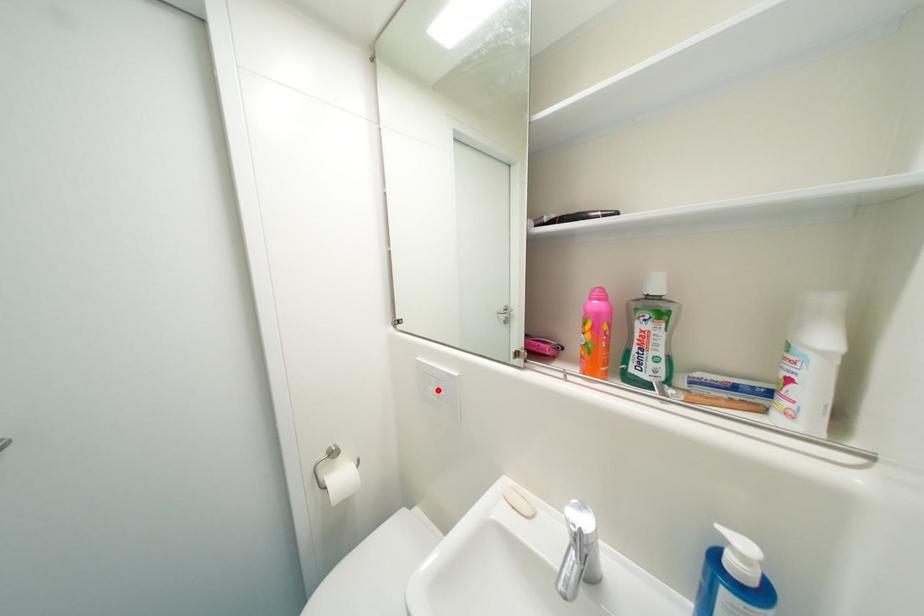
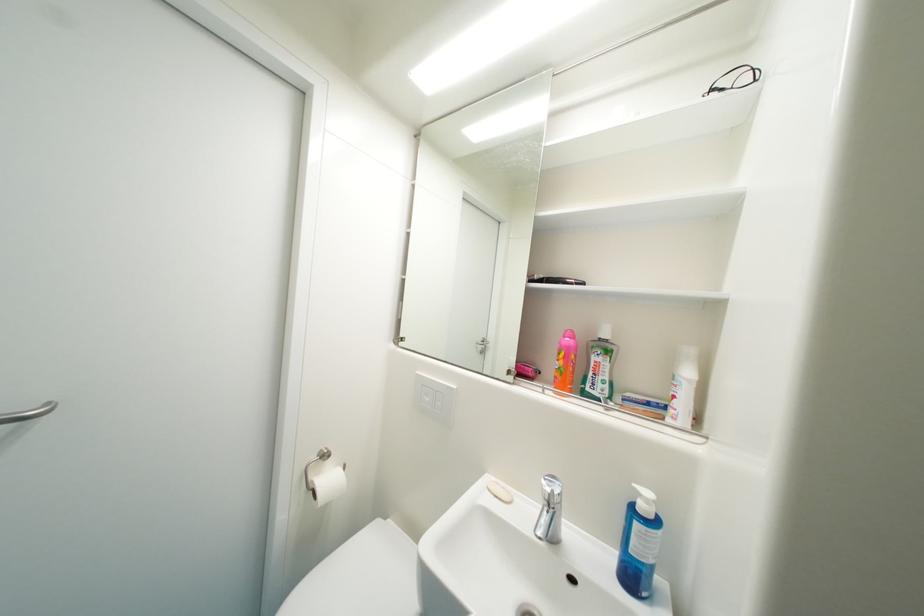
In the second image, find the point that corresponds to the highlighted location in the first image.

(433, 400)